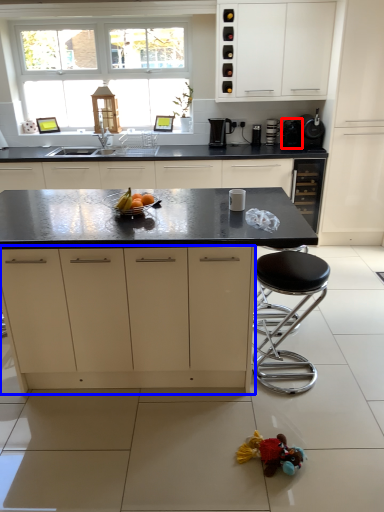
Question: Among these objects, which one is farthest to the camera, appliance (highlighted by a red box) or cabinetry (highlighted by a blue box)?

Choices:
 (A) appliance
 (B) cabinetry

Answer: (A)